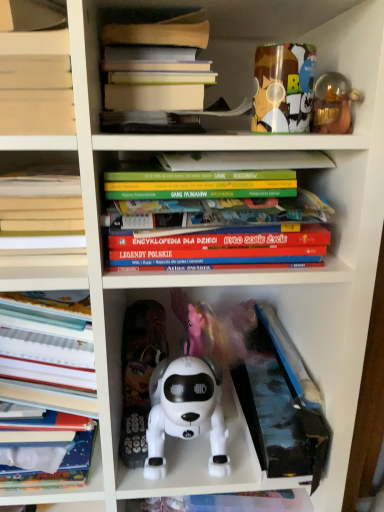
Question: Which direction should I rotate to look at white plastic toy dog at center, placed as the 4th toy when sorted from right to left?

Choices:
 (A) right
 (B) left

Answer: (B)

Question: Does hardcover books at upper center, which is the 1th book from top to bottom, have a greater height compared to white plastic robot dog at center, the fourth toy viewed from the top?

Choices:
 (A) yes
 (B) no

Answer: (B)

Question: Does hardcover books at upper center, the 4th book when ordered from bottom to top, have a smaller size compared to white plastic robot dog at center, which ranks as the second toy in left-to-right order?

Choices:
 (A) no
 (B) yes

Answer: (B)

Question: Considering the relative sizes of hardcover books at upper center, which is the 1th book from top to bottom, and white plastic robot dog at center, the fourth toy viewed from the top, in the image provided, is hardcover books at upper center, which is the 1th book from top to bottom, thinner than white plastic robot dog at center, the fourth toy viewed from the top,?

Choices:
 (A) yes
 (B) no

Answer: (B)

Question: Considering the relative positions of hardcover books at upper center, the 4th book when ordered from bottom to top, and white plastic robot dog at center, which ranks as the second toy in left-to-right order, in the image provided, is hardcover books at upper center, the 4th book when ordered from bottom to top, to the right of white plastic robot dog at center, which ranks as the second toy in left-to-right order, from the viewer's perspective?

Choices:
 (A) no
 (B) yes

Answer: (A)

Question: Can you confirm if hardcover books at upper center, the 4th book when ordered from bottom to top, is bigger than white plastic robot dog at center, the fourth toy viewed from the top?

Choices:
 (A) no
 (B) yes

Answer: (A)

Question: Could you tell me if hardcover books at upper center, the 4th book when ordered from bottom to top, is turned towards white plastic robot dog at center, the fourth toy viewed from the top?

Choices:
 (A) no
 (B) yes

Answer: (A)

Question: Is translucent glass figurine at upper right, which is counted as the third toy, starting from the bottom, positioned far away from hardcover book at left, which is the second book in bottom-to-top order?

Choices:
 (A) no
 (B) yes

Answer: (A)

Question: Considering the relative sizes of translucent glass figurine at upper right, which is the second toy from top to bottom, and hardcover book at left, which is the second book in bottom-to-top order, in the image provided, is translucent glass figurine at upper right, which is the second toy from top to bottom, bigger than hardcover book at left, which is the second book in bottom-to-top order,?

Choices:
 (A) no
 (B) yes

Answer: (A)

Question: Is translucent glass figurine at upper right, placed as the 1th toy when sorted from right to left, at the left side of hardcover book at left, which is the second book in bottom-to-top order?

Choices:
 (A) no
 (B) yes

Answer: (A)

Question: Is translucent glass figurine at upper right, placed as the 1th toy when sorted from right to left, surrounding hardcover book at left, which is the second book in bottom-to-top order?

Choices:
 (A) yes
 (B) no

Answer: (B)

Question: Is translucent glass figurine at upper right, which is the fourth toy from left to right, to the right of hardcover book at left, acting as the third book starting from the top, from the viewer's perspective?

Choices:
 (A) no
 (B) yes

Answer: (B)

Question: Is translucent glass figurine at upper right, which is the fourth toy from left to right, in front of hardcover book at left, which is the second book in bottom-to-top order?

Choices:
 (A) yes
 (B) no

Answer: (B)

Question: Is hardcover books at center, the second book viewed from the top, smaller than white plastic toy dog at center, which is the 3th toy in top-to-bottom order?

Choices:
 (A) yes
 (B) no

Answer: (B)